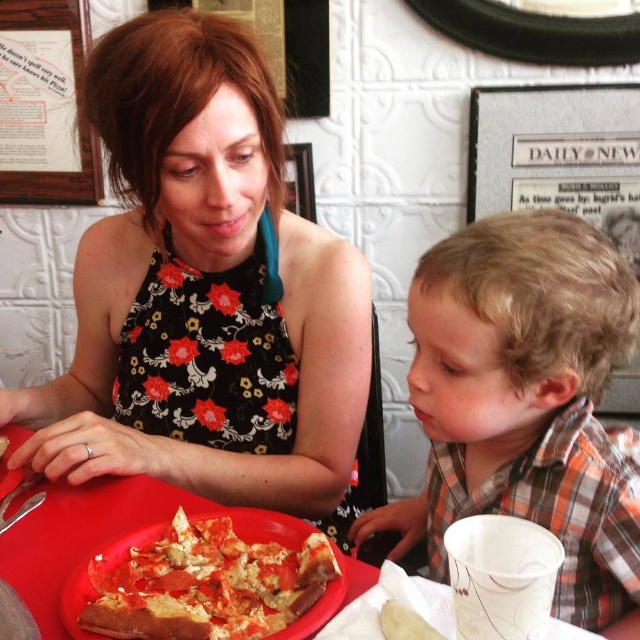
You are a photographer trying to capture the man in the plaid shirt at right without including the framed picture on the wall behind him. The framed picture is located at point (525, 403). Is the plaid shirt at right positioned to the left or right of this point?

The plaid shirt at right is located at point (525, 403), so it is exactly at the same position as the framed picture. Therefore, adjusting the camera angle might be necessary to avoid capturing both in the same frame.

You are a server at the restaurant and need to deliver a drink to the man wearing the plaid shirt at right. The drink must be placed exactly between him and the woman. How far apart should you place the drink from the woman?

The drink should be placed 10.98 inches from the woman, as the distance between the woman and the plaid shirt at right is 21.96 inches, so half of that distance is 10.98 inches.